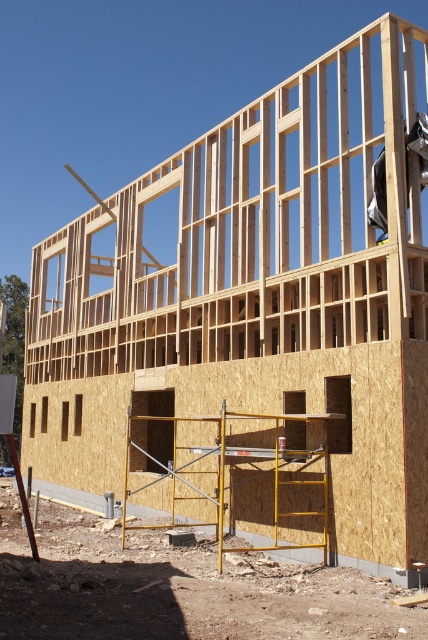
You are a construction worker standing at the edge of the construction site. You need to reach a tool placed on the yellow metal scaffolding at lower center. Considering your arm can extend 1.5 meters, can you reach the tool without moving closer?

The yellow metal scaffolding at lower center is 8.78 meters away from the viewer. Since your arm can only extend 1.5 meters, you cannot reach the tool placed on the yellow metal scaffolding at lower center without moving closer.

You are a construction worker standing at the point marked by the coordinates point (x=240, y=476). You need to reach the red cup placed on the scaffolding. Which direction should you move to find the red cup?

The point (x=240, y=476) marks the yellow metal scaffolding at lower center. Since the red cup is placed on one of the scaffolding horizontal supports, you should look upwards along the scaffolding structure to locate the red cup.

You are a construction worker standing on the ground near the yellow metal scaffolding at lower center. You need to hand a tool to the dark gray fabric construction worker at upper right. Which direction should you move the tool to ensure they can reach it?

You should move the tool to the right because the yellow metal scaffolding at lower center is to the left of the dark gray fabric construction worker at upper right, so moving it right would bring it closer to their position.